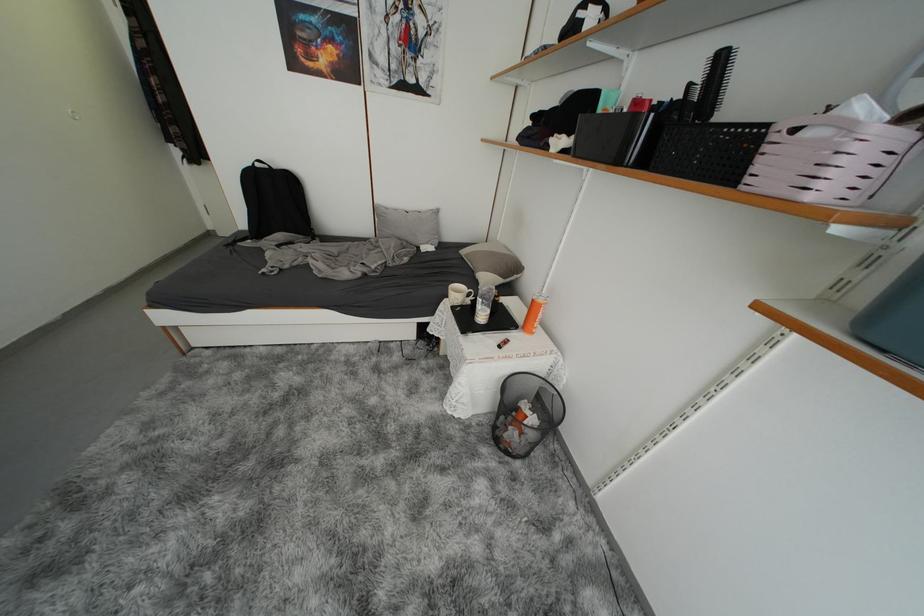
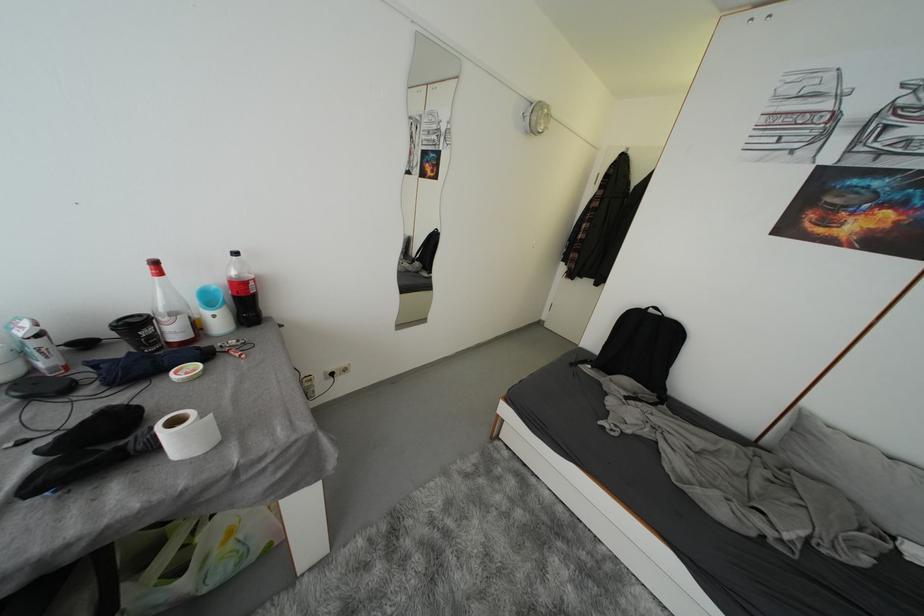
Question: The camera is either moving clockwise (left) or counter-clockwise (right) around the object. The first image is from the beginning of the video and the second image is from the end. Is the camera moving left or right when shooting the video?

Choices:
 (A) Left
 (B) Right

Answer: (B)